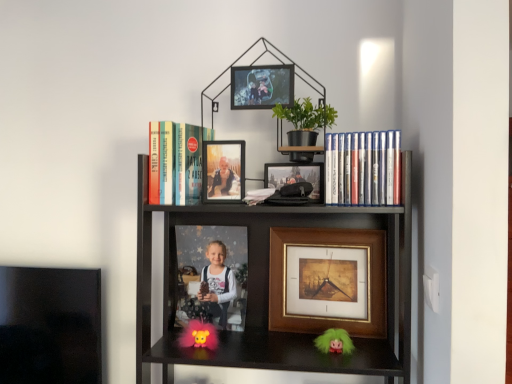
Image resolution: width=512 pixels, height=384 pixels. Describe the element at coordinates (262, 86) in the screenshot. I see `metallic silver picture frame at upper center, which is the fourth picture frame in bottom-to-top order` at that location.

At what (x,y) coordinates should I click in order to perform the action: click on silver metallic dvds at right, arranged as the first book when viewed from the right. Please return your answer as a coordinate pair (x, y). Looking at the image, I should click on (362, 168).

Measure the distance between gold/glossy picture frame at center, which is counted as the first picture frame, starting from the bottom, and camera.

gold/glossy picture frame at center, which is counted as the first picture frame, starting from the bottom, and camera are 3.66 feet apart from each other.

Image resolution: width=512 pixels, height=384 pixels. Describe the element at coordinates (223, 171) in the screenshot. I see `matte plastic photo frame at upper center, marked as the third picture frame in a bottom-to-top arrangement` at that location.

Where is `hardcover book at upper left, which is counted as the 2th book, starting from the right`? hardcover book at upper left, which is counted as the 2th book, starting from the right is located at coordinates (175, 162).

How much space does hardcover book at upper left, which is counted as the 2th book, starting from the right, occupy vertically?

It is 8.15 inches.

I want to click on metallic silver picture frame at upper center, arranged as the 4th picture frame when viewed from the back, so click(x=262, y=86).

Considering the positions of point (202, 136) and point (334, 337), is point (202, 136) closer or farther from the camera than point (334, 337)?

Point (202, 136) is farther from the camera than point (334, 337).

Could you tell me if hardcover book at upper left, which is counted as the 2th book, starting from the right, is turned towards green fuzzy doll at lower center?

No, hardcover book at upper left, which is counted as the 2th book, starting from the right, does not turn towards green fuzzy doll at lower center.

Which object is closer to the camera taking this photo, hardcover book at upper left, acting as the 1th book starting from the left, or green fuzzy doll at lower center?

hardcover book at upper left, acting as the 1th book starting from the left.

From a real-world perspective, which object stands above the other?

In real-world perspective, gold/glossy picture frame at center, which appears as the 2th picture frame when viewed from the back, is above.

Measure the distance between green fuzzy doll at lower center and gold/glossy picture frame at center, which appears as the 2th picture frame when viewed from the back.

green fuzzy doll at lower center and gold/glossy picture frame at center, which appears as the 2th picture frame when viewed from the back, are 16.03 centimeters apart.

In the image, is green fuzzy doll at lower center positioned in front of or behind gold/glossy picture frame at center, which appears as the 2th picture frame when viewed from the back?

Clearly, green fuzzy doll at lower center is in front of gold/glossy picture frame at center, which appears as the 2th picture frame when viewed from the back.

Considering the relative sizes of green fuzzy doll at lower center and gold/glossy picture frame at center, which is counted as the 3th picture frame, starting from the front, in the image provided, is green fuzzy doll at lower center bigger than gold/glossy picture frame at center, which is counted as the 3th picture frame, starting from the front,?

No.

Considering the relative positions of matte plastic photo frame at center, acting as the 2th picture frame starting from the bottom, and silver metallic dvds at right, arranged as the first book when viewed from the right, in the image provided, is matte plastic photo frame at center, acting as the 2th picture frame starting from the bottom, to the right of silver metallic dvds at right, arranged as the first book when viewed from the right, from the viewer's perspective?

No.

Are matte plastic photo frame at center, acting as the 2th picture frame starting from the bottom, and silver metallic dvds at right, arranged as the first book when viewed from the right, located far from each other?

matte plastic photo frame at center, acting as the 2th picture frame starting from the bottom, is near silver metallic dvds at right, arranged as the first book when viewed from the right, not far away.

Who is more distant, matte plastic photo frame at center, positioned as the 1th picture frame in back-to-front order, or silver metallic dvds at right, the 2th book when ordered from left to right?

matte plastic photo frame at center, positioned as the 1th picture frame in back-to-front order, is more distant.

From the image's perspective, which is above, matte plastic photo frame at center, which ranks as the fourth picture frame in front-to-back order, or silver metallic dvds at right, arranged as the first book when viewed from the right?

silver metallic dvds at right, arranged as the first book when viewed from the right, from the image's perspective.

Which of these two, hardcover book at upper left, which is counted as the 2th book, starting from the right, or matte plastic photo frame at center, acting as the 2th picture frame starting from the bottom, is wider?

hardcover book at upper left, which is counted as the 2th book, starting from the right.

Considering their positions, is hardcover book at upper left, which is counted as the 2th book, starting from the right, located in front of or behind matte plastic photo frame at center, positioned as the 1th picture frame in back-to-front order?

hardcover book at upper left, which is counted as the 2th book, starting from the right, is positioned closer to the viewer than matte plastic photo frame at center, positioned as the 1th picture frame in back-to-front order.

How many degrees apart are the facing directions of hardcover book at upper left, acting as the 1th book starting from the left, and matte plastic photo frame at center, which ranks as the fourth picture frame in front-to-back order?

The angle between the facing direction of hardcover book at upper left, acting as the 1th book starting from the left, and the facing direction of matte plastic photo frame at center, which ranks as the fourth picture frame in front-to-back order, is 3.88 degrees.

Is hardcover book at upper left, acting as the 1th book starting from the left, completely or partially outside of matte plastic photo frame at center, the third picture frame when ordered from top to bottom?

Yes, hardcover book at upper left, acting as the 1th book starting from the left, is outside of matte plastic photo frame at center, the third picture frame when ordered from top to bottom.

Is green fuzzy doll at lower center oriented away from silver metallic dvds at right, the 2th book when ordered from left to right?

No, green fuzzy doll at lower center's orientation is not away from silver metallic dvds at right, the 2th book when ordered from left to right.

Do you think green fuzzy doll at lower center is within silver metallic dvds at right, the 2th book when ordered from left to right, or outside of it?

green fuzzy doll at lower center is not inside silver metallic dvds at right, the 2th book when ordered from left to right, it's outside.

From the image's perspective, which one is positioned higher, green fuzzy doll at lower center or silver metallic dvds at right, arranged as the first book when viewed from the right?

From the image's view, silver metallic dvds at right, arranged as the first book when viewed from the right, is above.

Is the depth of green fuzzy doll at lower center greater than that of silver metallic dvds at right, the 2th book when ordered from left to right?

Yes, it is behind silver metallic dvds at right, the 2th book when ordered from left to right.

How distant is green fuzzy doll at lower center from matte plastic photo frame at upper center, positioned as the second picture frame in front-to-back order?

A distance of 17.84 inches exists between green fuzzy doll at lower center and matte plastic photo frame at upper center, positioned as the second picture frame in front-to-back order.

Looking at this image, considering the relative sizes of green fuzzy doll at lower center and matte plastic photo frame at upper center, positioned as the second picture frame in front-to-back order, in the image provided, is green fuzzy doll at lower center wider than matte plastic photo frame at upper center, positioned as the second picture frame in front-to-back order,?

Yes.

Can you confirm if green fuzzy doll at lower center is shorter than matte plastic photo frame at upper center, marked as the 3th picture frame in a back-to-front arrangement?

Yes, green fuzzy doll at lower center is shorter than matte plastic photo frame at upper center, marked as the 3th picture frame in a back-to-front arrangement.

Locate an element on the screen. The height and width of the screenshot is (384, 512). doll in front of the matte plastic photo frame at upper center, marked as the second picture frame in a top-to-bottom arrangement is located at coordinates (334, 342).

Considering the relative positions of matte plastic photo frame at upper center, marked as the third picture frame in a bottom-to-top arrangement, and black matte bookcase at center in the image provided, is matte plastic photo frame at upper center, marked as the third picture frame in a bottom-to-top arrangement, to the right of black matte bookcase at center from the viewer's perspective?

No, matte plastic photo frame at upper center, marked as the third picture frame in a bottom-to-top arrangement, is not to the right of black matte bookcase at center.

Is matte plastic photo frame at upper center, positioned as the second picture frame in front-to-back order, aimed at black matte bookcase at center?

Yes, matte plastic photo frame at upper center, positioned as the second picture frame in front-to-back order, is facing black matte bookcase at center.

Does matte plastic photo frame at upper center, positioned as the second picture frame in front-to-back order, have a smaller size compared to black matte bookcase at center?

Correct, matte plastic photo frame at upper center, positioned as the second picture frame in front-to-back order, occupies less space than black matte bookcase at center.

At what (x,y) coordinates should I click in order to perform the action: click on the 1st picture frame positioned above the black matte bookcase at center (from a real-world perspective). Please return your answer as a coordinate pair (x, y). Image resolution: width=512 pixels, height=384 pixels. Looking at the image, I should click on click(x=223, y=171).

I want to click on book that is the 1st object located in front of the green fuzzy doll at lower center, so (x=175, y=162).

The image size is (512, 384). There is a green fuzzy doll at lower center. What are the coordinates of `the 1st picture frame above it (from the image's perspective)` in the screenshot? It's located at (328, 281).

Which object lies further to the anchor point black matte bookcase at center, metallic silver picture frame at upper center, arranged as the 4th picture frame when viewed from the back, or silver metallic dvds at right, arranged as the first book when viewed from the right?

metallic silver picture frame at upper center, arranged as the 4th picture frame when viewed from the back.

Based on their spatial positions, is fluffy pink toy at center or metallic silver picture frame at upper center, acting as the first picture frame starting from the front, further from green fuzzy doll at lower center?

metallic silver picture frame at upper center, acting as the first picture frame starting from the front.

Estimate the real-world distances between objects in this image. Which object is further from fluffy pink toy at center, silver metallic dvds at right, arranged as the first book when viewed from the right, or matte plastic photo frame at center, the third picture frame when ordered from top to bottom?

silver metallic dvds at right, arranged as the first book when viewed from the right, is further to fluffy pink toy at center.

Which object lies nearer to the anchor point metallic silver picture frame at upper center, acting as the first picture frame starting from the front, fluffy pink toy at center or hardcover book at upper left, which is counted as the 2th book, starting from the right?

hardcover book at upper left, which is counted as the 2th book, starting from the right, is closer to metallic silver picture frame at upper center, acting as the first picture frame starting from the front.

When comparing their distances from hardcover book at upper left, acting as the 1th book starting from the left, does matte plastic photo frame at center, acting as the 2th picture frame starting from the bottom, or metallic silver picture frame at upper center, acting as the first picture frame starting from the front, seem further?

Among the two, matte plastic photo frame at center, acting as the 2th picture frame starting from the bottom, is located further to hardcover book at upper left, acting as the 1th book starting from the left.

When comparing their distances from black matte bookcase at center, does matte plastic photo frame at upper center, marked as the third picture frame in a bottom-to-top arrangement, or matte plastic photo frame at center, positioned as the 1th picture frame in back-to-front order, seem further?

Among the two, matte plastic photo frame at upper center, marked as the third picture frame in a bottom-to-top arrangement, is located further to black matte bookcase at center.

Which object lies further to the anchor point gold/glossy picture frame at center, which is counted as the 3th picture frame, starting from the front, silver metallic dvds at right, arranged as the first book when viewed from the right, or fluffy pink toy at center?

fluffy pink toy at center.

From the image, which object appears to be nearer to gold/glossy picture frame at center, which is counted as the 3th picture frame, starting from the front, matte plastic photo frame at upper center, marked as the 3th picture frame in a back-to-front arrangement, or black matte bookcase at center?

The object closer to gold/glossy picture frame at center, which is counted as the 3th picture frame, starting from the front, is black matte bookcase at center.

Where is `bookcase between silver metallic dvds at right, arranged as the first book when viewed from the right, and gold/glossy picture frame at center, which is counted as the 3th picture frame, starting from the front, vertically`? bookcase between silver metallic dvds at right, arranged as the first book when viewed from the right, and gold/glossy picture frame at center, which is counted as the 3th picture frame, starting from the front, vertically is located at coordinates (268, 287).

Identify the location of bookcase that lies between matte plastic photo frame at upper center, marked as the third picture frame in a bottom-to-top arrangement, and gold/glossy picture frame at center, which appears as the 2th picture frame when viewed from the back, from top to bottom. (268, 287).

This screenshot has height=384, width=512. I want to click on bookcase that lies between hardcover book at upper left, acting as the 1th book starting from the left, and green fuzzy doll at lower center from top to bottom, so click(x=268, y=287).

Locate an element on the screen. picture frame between hardcover book at upper left, which is counted as the 2th book, starting from the right, and matte plastic photo frame at center, positioned as the 1th picture frame in back-to-front order, in the vertical direction is located at coordinates tap(223, 171).